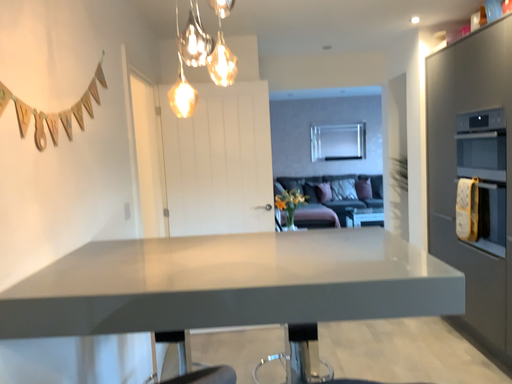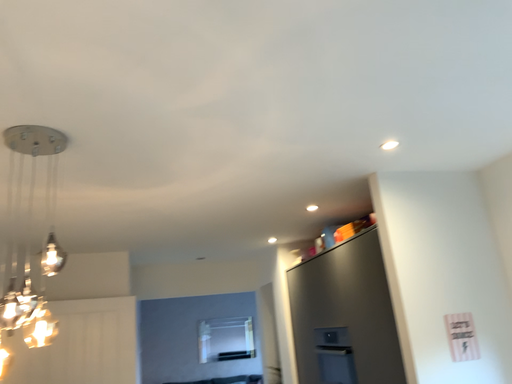
Question: How did the camera likely rotate when shooting the video?

Choices:
 (A) rotated downward
 (B) rotated upward

Answer: (B)